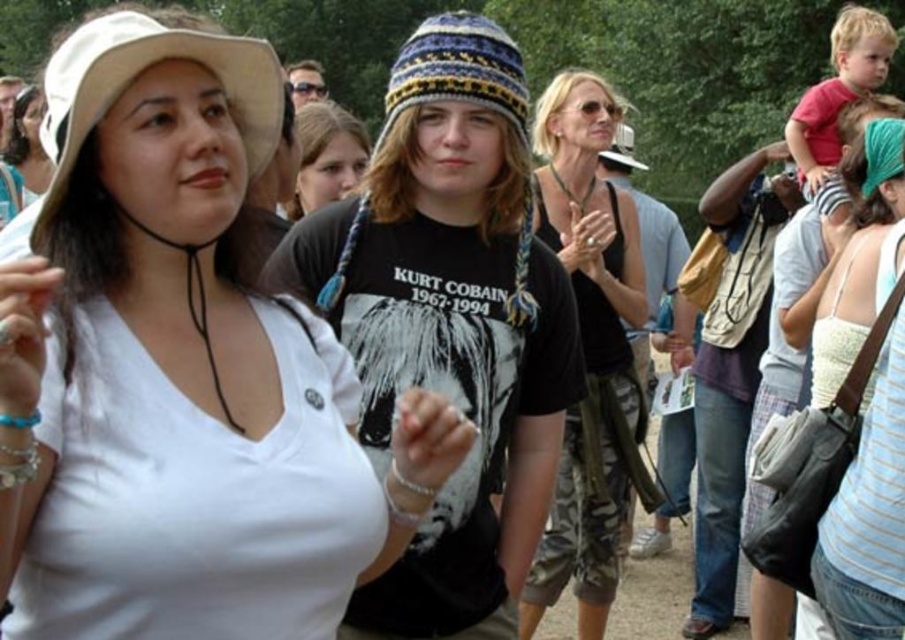
Question: Estimate the real-world distances between objects in this image. Which object is closer to the knitted woolen beanie at center?

Choices:
 (A) red cotton shirt at upper right
 (B) blonde hair at center
 (C) white matte shirt at center

Answer: (C)

Question: Is knitted woolen beanie at center smaller than matte white shirt at upper left?

Choices:
 (A) no
 (B) yes

Answer: (A)

Question: Is knitted woolen beanie at center positioned at the back of red cotton shirt at upper right?

Choices:
 (A) no
 (B) yes

Answer: (A)

Question: Among these objects, which one is nearest to the camera?

Choices:
 (A) black matte tank top at center
 (B) white fabric hat at upper left
 (C) white striped tank top at center

Answer: (B)

Question: Which of these objects is positioned closest to the white striped tank top at center?

Choices:
 (A) red cotton shirt at upper right
 (B) white fabric hat at upper left

Answer: (A)

Question: Is knitted wool hat at center further to camera compared to white fabric hat at upper left?

Choices:
 (A) yes
 (B) no

Answer: (A)